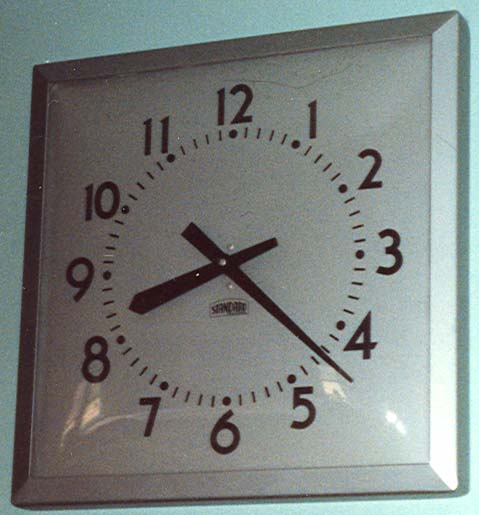
Identify the location of minute hand of clock. The image size is (479, 515). (279, 317).